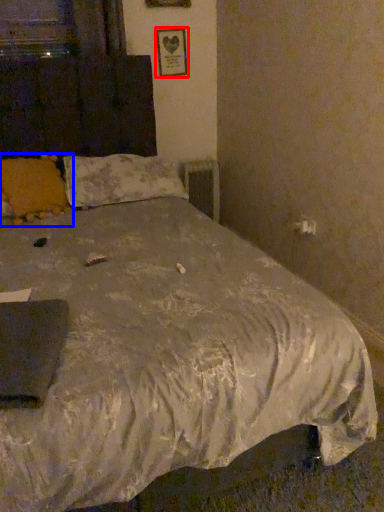
Question: Which object appears closest to the camera in this image, picture frame (highlighted by a red box) or pillow (highlighted by a blue box)?

Choices:
 (A) picture frame
 (B) pillow

Answer: (B)